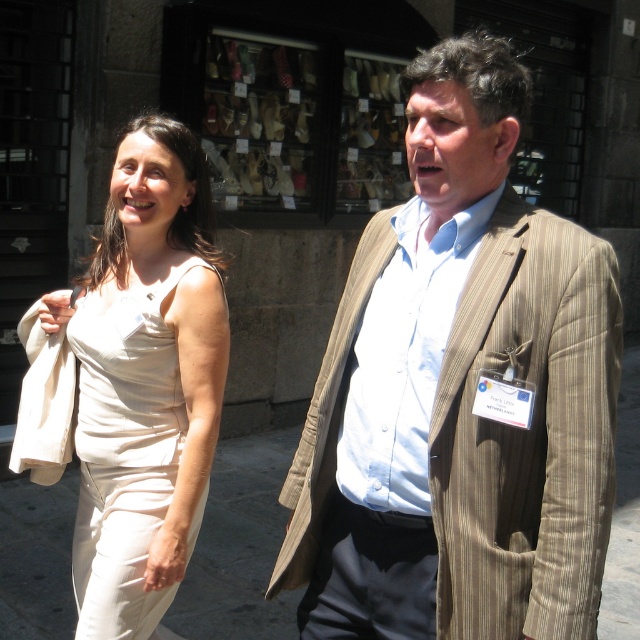
Question: Which point is farther to the camera?

Choices:
 (A) (104, 307)
 (B) (449, 445)

Answer: (A)

Question: Is brown striped blazer at center to the right of beige fabric dress at left from the viewer's perspective?

Choices:
 (A) yes
 (B) no

Answer: (A)

Question: Is the position of brown striped blazer at center less distant than that of beige fabric dress at left?

Choices:
 (A) no
 (B) yes

Answer: (B)

Question: Can you confirm if brown striped blazer at center is thinner than beige fabric dress at left?

Choices:
 (A) yes
 (B) no

Answer: (B)

Question: Which point is closer to the camera?

Choices:
 (A) brown striped blazer at center
 (B) beige fabric dress at left

Answer: (A)

Question: Which point is closer to the camera?

Choices:
 (A) (144, 164)
 (B) (426, 493)

Answer: (B)